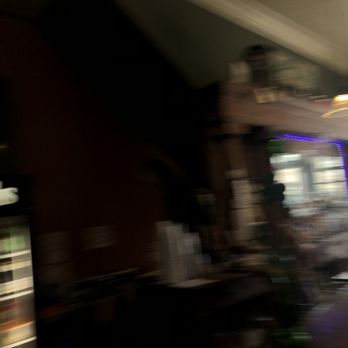
I want to click on light, so click(x=342, y=97).